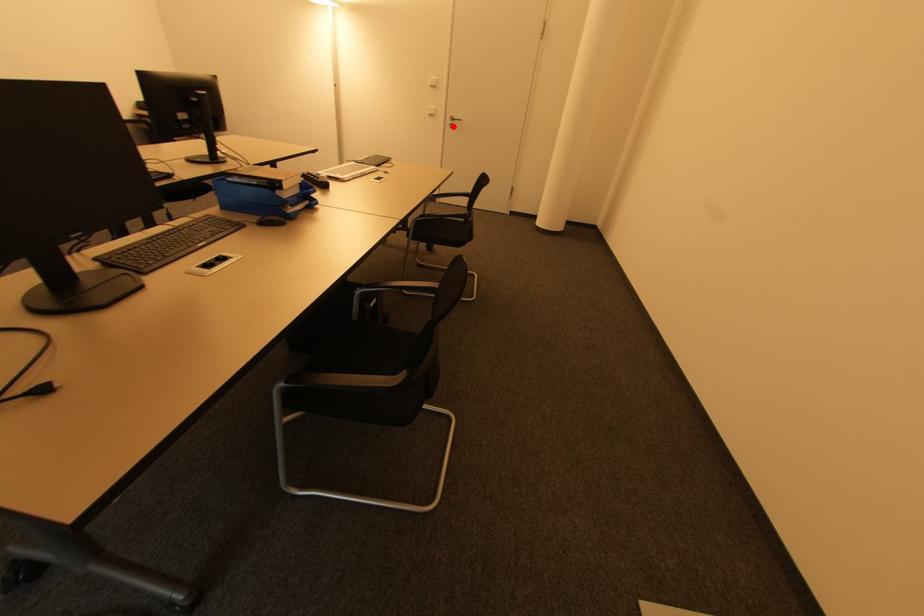
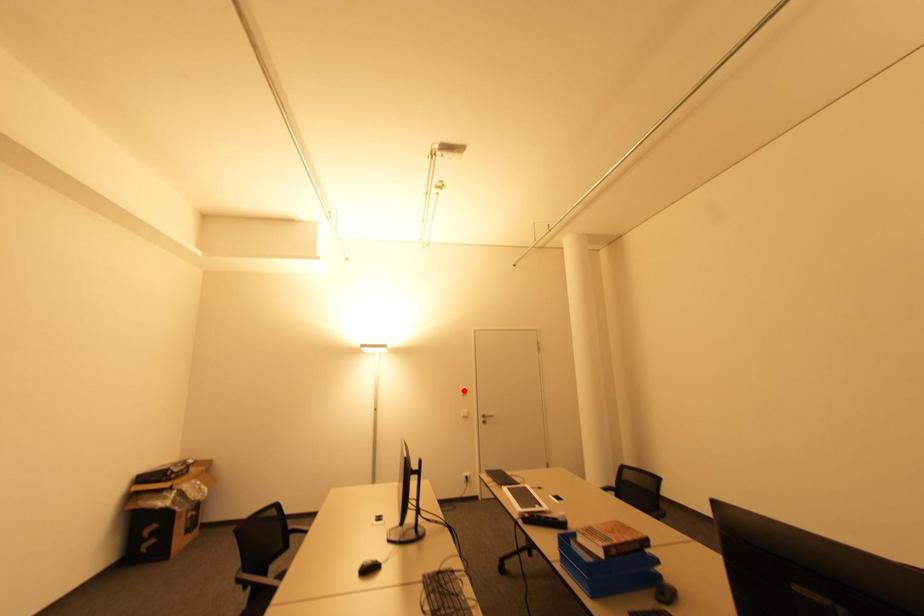
I am providing you with two images of the same scene from different viewpoints. A red point is marked on the first image and another point is marked on the second image. Do the highlighted points in image1 and image2 indicate the same real-world spot?

No